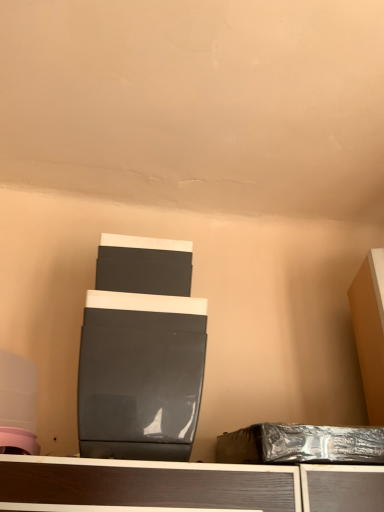
What do you see at coordinates (370, 330) in the screenshot? The height and width of the screenshot is (512, 384). I see `matte orange cabinet at right` at bounding box center [370, 330].

Where is `glossy black speaker at center`? glossy black speaker at center is located at coordinates (140, 375).

Is the depth of glossy black speaker at center greater than that of matte orange cabinet at right?

No, it is in front of matte orange cabinet at right.

What's the angular difference between glossy black speaker at center and matte orange cabinet at right's facing directions?

They differ by 11.7 degrees in their facing directions.

From the image's perspective, is glossy black speaker at center on matte orange cabinet at right?

Actually, glossy black speaker at center appears below matte orange cabinet at right in the image.

Does glossy black speaker at center have a greater width compared to matte orange cabinet at right?

Yes, glossy black speaker at center is wider than matte orange cabinet at right.

From a real-world perspective, which object stands above the other?

matte orange cabinet at right, from a real-world perspective.

Does shiny metallic box at lower right have a greater height compared to matte orange cabinet at right?

In fact, shiny metallic box at lower right may be shorter than matte orange cabinet at right.

Which is further, (346, 451) or (374, 286)?

The point (374, 286) is behind.

Is matte orange cabinet at right facing away from shiny metallic box at lower right?

matte orange cabinet at right is not turned away from shiny metallic box at lower right.

Who is shorter, matte orange cabinet at right or shiny metallic box at lower right?

shiny metallic box at lower right.

From a real-world perspective, which object stands above the other?

matte orange cabinet at right.

Is matte orange cabinet at right to the left of shiny metallic box at lower right from the viewer's perspective?

No, matte orange cabinet at right is not to the left of shiny metallic box at lower right.

Based on the photo, which object is positioned more to the left, glossy black speaker at center or shiny metallic box at lower right?

glossy black speaker at center.

Which object is wider, glossy black speaker at center or shiny metallic box at lower right?

Wider between the two is glossy black speaker at center.

Is glossy black speaker at center looking in the opposite direction of shiny metallic box at lower right?

No, glossy black speaker at center is not facing the opposite direction of shiny metallic box at lower right.

From the image's perspective, who appears lower, glossy black speaker at center or shiny metallic box at lower right?

shiny metallic box at lower right.

From a real-world perspective, does shiny metallic box at lower right stand above glossy black speaker at center?

No, from a real-world perspective, shiny metallic box at lower right is not over glossy black speaker at center

Where is `waste below the glossy black speaker at center (from the image's perspective)`? This screenshot has height=512, width=384. waste below the glossy black speaker at center (from the image's perspective) is located at coordinates (301, 444).

From the image's perspective, which one is positioned lower, shiny metallic box at lower right or glossy black speaker at center?

shiny metallic box at lower right, from the image's perspective.

Considering the positions of objects matte orange cabinet at right and glossy black speaker at center in the image provided, who is more to the left, matte orange cabinet at right or glossy black speaker at center?

glossy black speaker at center is more to the left.

I want to click on furniture above the glossy black speaker at center (from a real-world perspective), so click(370, 330).

Is glossy black speaker at center a part of matte orange cabinet at right?

That's incorrect, glossy black speaker at center is not inside matte orange cabinet at right.

From their relative heights in the image, would you say matte orange cabinet at right is taller or shorter than glossy black speaker at center?

Clearly, matte orange cabinet at right is taller compared to glossy black speaker at center.

Find the location of a particular element. The image size is (384, 512). furniture above the glossy black speaker at center (from a real-world perspective) is located at coordinates (370, 330).

Identify the location of waste in front of the matte orange cabinet at right. This screenshot has height=512, width=384. tap(301, 444).

Based on their spatial positions, is shiny metallic box at lower right or glossy black speaker at center further from matte orange cabinet at right?

Among the two, glossy black speaker at center is located further to matte orange cabinet at right.

Estimate the real-world distances between objects in this image. Which object is further from glossy black speaker at center, matte orange cabinet at right or shiny metallic box at lower right?

matte orange cabinet at right is further to glossy black speaker at center.

Based on their spatial positions, is glossy black speaker at center or matte orange cabinet at right closer to shiny metallic box at lower right?

glossy black speaker at center lies closer to shiny metallic box at lower right than the other object.

Which object lies nearer to the anchor point matte orange cabinet at right, glossy black speaker at center or shiny metallic box at lower right?

Based on the image, shiny metallic box at lower right appears to be nearer to matte orange cabinet at right.

When comparing their distances from glossy black speaker at center, does shiny metallic box at lower right or matte orange cabinet at right seem closer?

shiny metallic box at lower right lies closer to glossy black speaker at center than the other object.

Which object lies nearer to the anchor point shiny metallic box at lower right, matte orange cabinet at right or glossy black speaker at center?

The object closer to shiny metallic box at lower right is glossy black speaker at center.

Where is `waste located between glossy black speaker at center and matte orange cabinet at right in the left-right direction`? waste located between glossy black speaker at center and matte orange cabinet at right in the left-right direction is located at coordinates (301, 444).